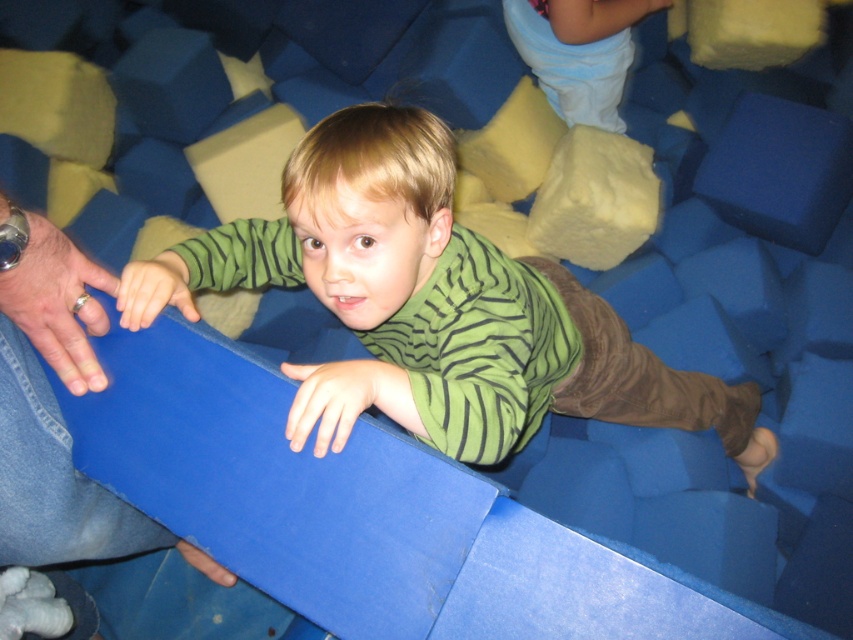
Consider the image. You are a photographer setting up for a group photo in the play area. You notice the green striped shirt at center and the light blue fabric pants at upper center. From the photographer viewpoint, which object is positioned to the left?

The green striped shirt at center is to the left of light blue fabric pants at upper center.

The scene shows a child interacting with a blue foam pit. There is a point at coordinates (434, 307). What object or feature is located at that point?

The point at coordinates (434, 307) corresponds to the green striped shirt at center.